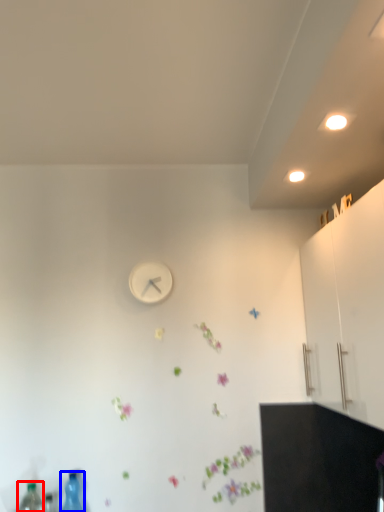
Question: Which of the following is the farthest to the observer, bottle (highlighted by a red box) or bottle (highlighted by a blue box)?

Choices:
 (A) bottle
 (B) bottle

Answer: (B)